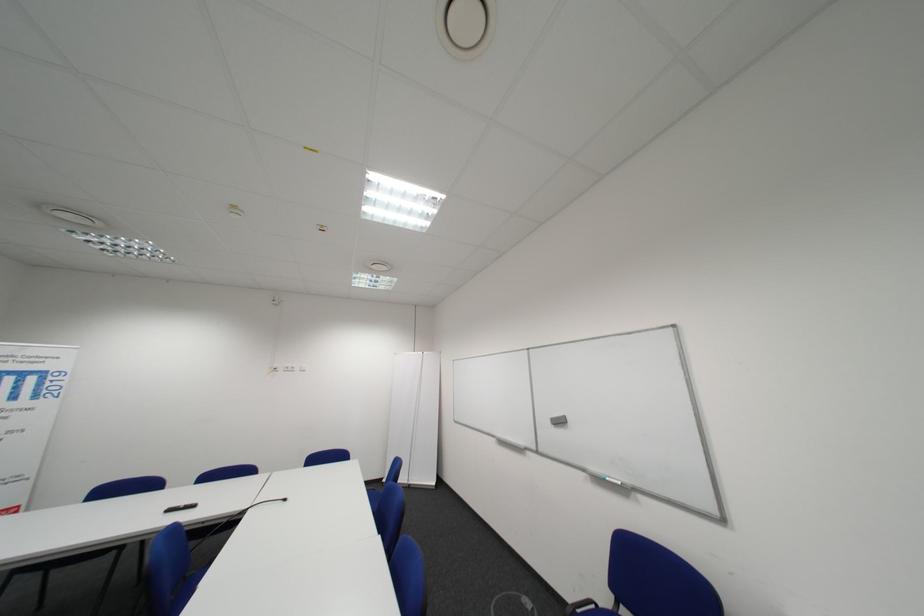
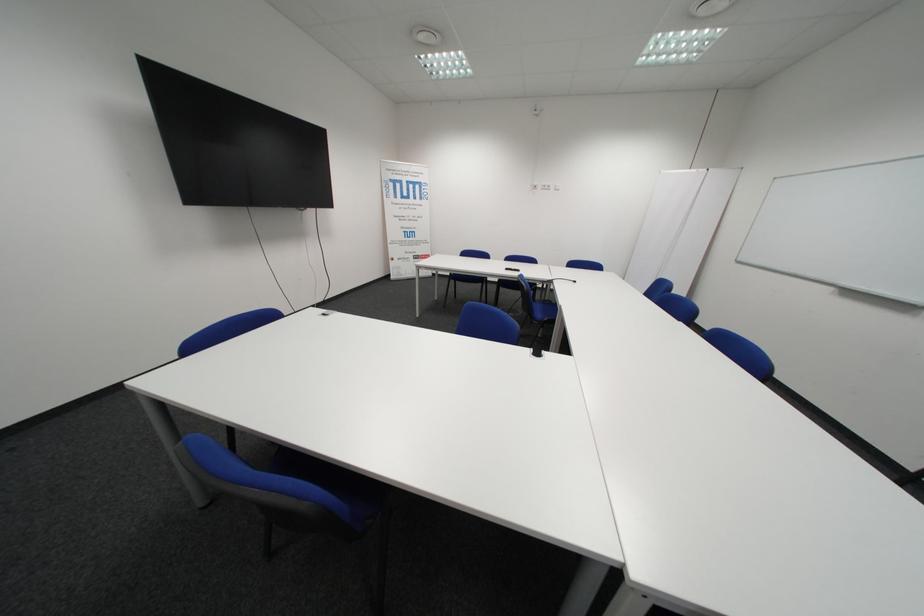
Locate, in the second image, the point that corresponds to (180,512) in the first image.

(518, 270)